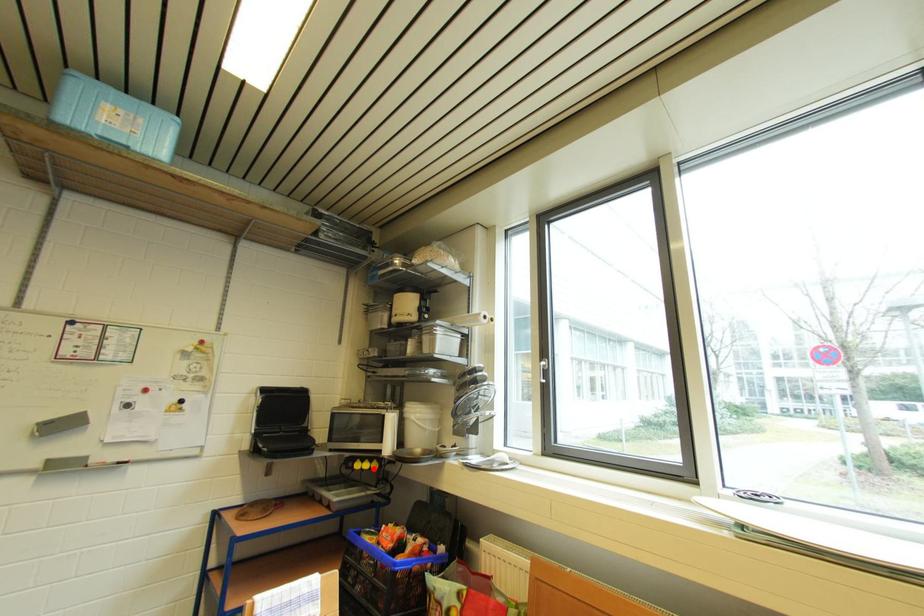
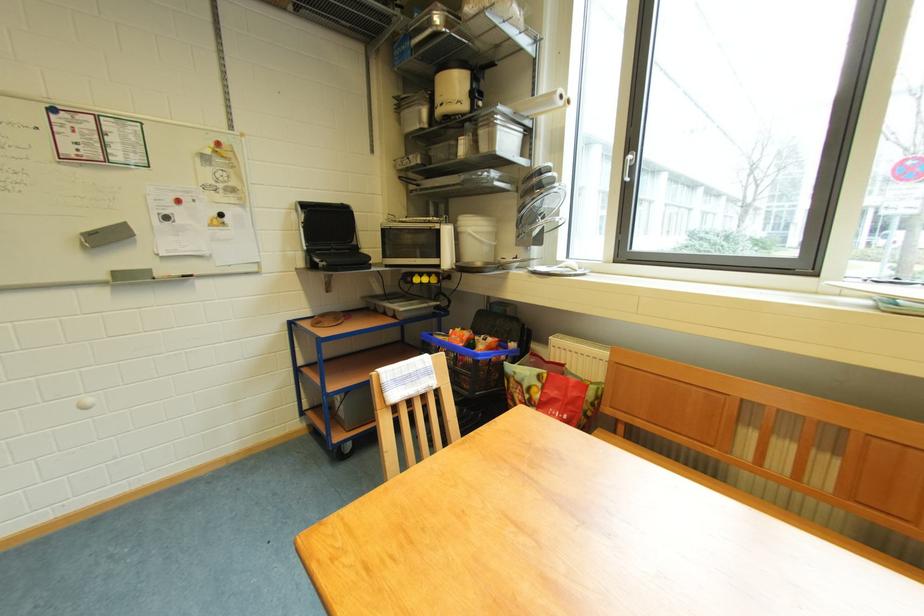
In the second image, find the point that corresponds to the highlighted location in the first image.

(432, 283)